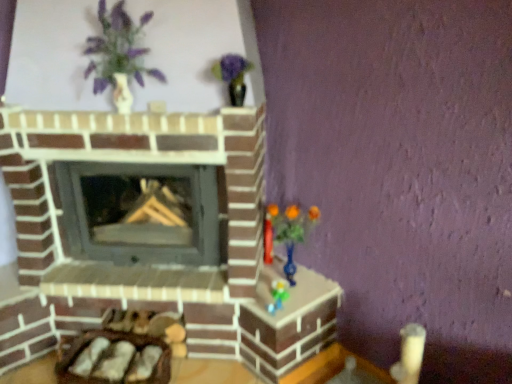
Question: Can you confirm if translucent blue vase at right is smaller than smooth gray wood burning stove at center?

Choices:
 (A) no
 (B) yes

Answer: (B)

Question: Is translucent blue vase at right to the right of smooth gray wood burning stove at center from the viewer's perspective?

Choices:
 (A) yes
 (B) no

Answer: (A)

Question: From a real-world perspective, is translucent blue vase at right positioned under smooth gray wood burning stove at center based on gravity?

Choices:
 (A) yes
 (B) no

Answer: (A)

Question: Is smooth gray wood burning stove at center inside translucent blue vase at right?

Choices:
 (A) no
 (B) yes

Answer: (A)

Question: Can you confirm if translucent blue vase at right is positioned to the left of smooth gray wood burning stove at center?

Choices:
 (A) yes
 (B) no

Answer: (B)

Question: Is translucent blue vase at right wider than smooth gray wood burning stove at center?

Choices:
 (A) no
 (B) yes

Answer: (A)

Question: Does smooth gray wood burning stove at center have a larger size compared to translucent blue vase at right?

Choices:
 (A) no
 (B) yes

Answer: (B)

Question: Is smooth gray wood burning stove at center oriented towards translucent blue vase at right?

Choices:
 (A) no
 (B) yes

Answer: (A)

Question: Considering the relative positions of smooth gray wood burning stove at center and translucent blue vase at right in the image provided, is smooth gray wood burning stove at center in front of translucent blue vase at right?

Choices:
 (A) yes
 (B) no

Answer: (B)

Question: Can you confirm if smooth gray wood burning stove at center is taller than translucent blue vase at right?

Choices:
 (A) yes
 (B) no

Answer: (A)

Question: Is smooth gray wood burning stove at center positioned with its back to translucent blue vase at right?

Choices:
 (A) no
 (B) yes

Answer: (A)

Question: Can you confirm if smooth gray wood burning stove at center is wider than translucent blue vase at right?

Choices:
 (A) no
 (B) yes

Answer: (B)

Question: From a real-world perspective, is smooth gray wood burning stove at center on matte white vase at upper left?

Choices:
 (A) no
 (B) yes

Answer: (A)